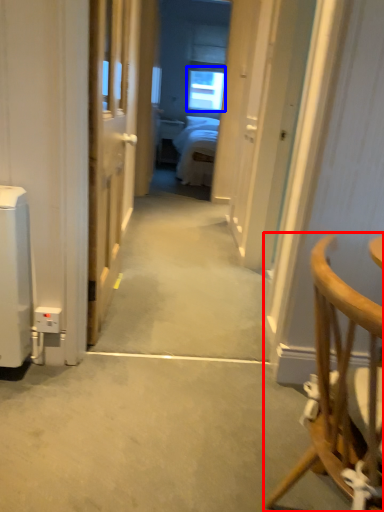
Question: Which object appears farthest to the camera in this image, chair (highlighted by a red box) or window (highlighted by a blue box)?

Choices:
 (A) chair
 (B) window

Answer: (B)